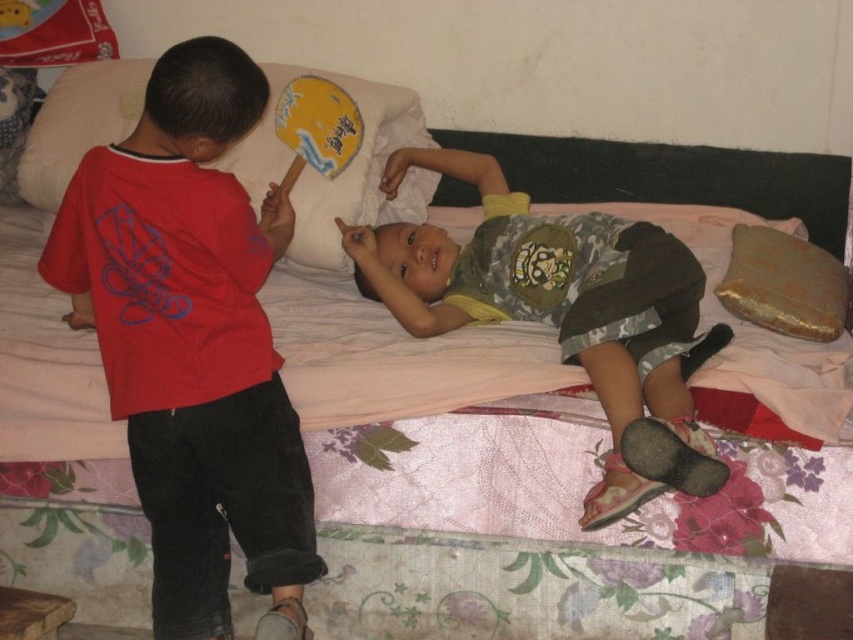
Can you confirm if matte red shirt at left is bigger than yellow fabric pillow at upper left?

Correct, matte red shirt at left is larger in size than yellow fabric pillow at upper left.

Between matte red shirt at left and yellow fabric pillow at upper left, which one appears on the right side from the viewer's perspective?

From the viewer's perspective, yellow fabric pillow at upper left appears more on the right side.

Find the location of `matte red shirt at left`. matte red shirt at left is located at coordinates (193, 342).

Which is more to the right, matte red shirt at left or yellow paper fan at upper center?

yellow paper fan at upper center is more to the right.

Does point (166, 241) come behind point (335, 160)?

No, it is not.

Is point (155, 609) closer to camera compared to point (317, 150)?

Yes.

You are a GUI agent. You are given a task and a screenshot of the screen. Output one action in this format:
    pyautogui.click(x=<x>, y=<y>)
    Task: Click on the matte red shirt at left
    
    Given the screenshot: What is the action you would take?
    pyautogui.click(x=193, y=342)

Who is taller, matte red shirt at left or camouflage fabric shirt at center?

matte red shirt at left

The height and width of the screenshot is (640, 853). What do you see at coordinates (193, 342) in the screenshot?
I see `matte red shirt at left` at bounding box center [193, 342].

Locate an element on the screen. This screenshot has width=853, height=640. matte red shirt at left is located at coordinates [x=193, y=342].